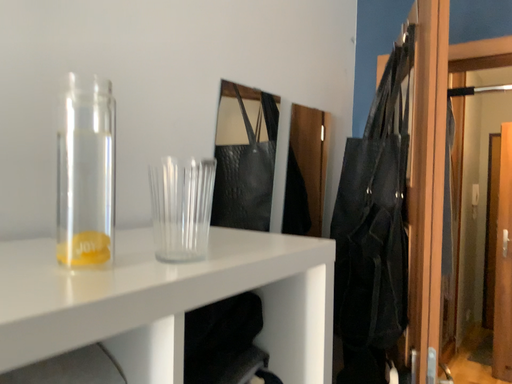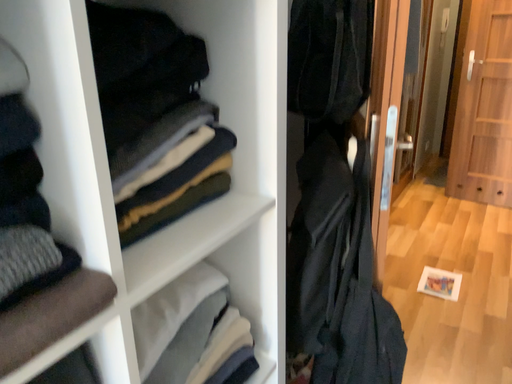
Question: Which way did the camera rotate in the video?

Choices:
 (A) rotated downward
 (B) rotated upward

Answer: (A)